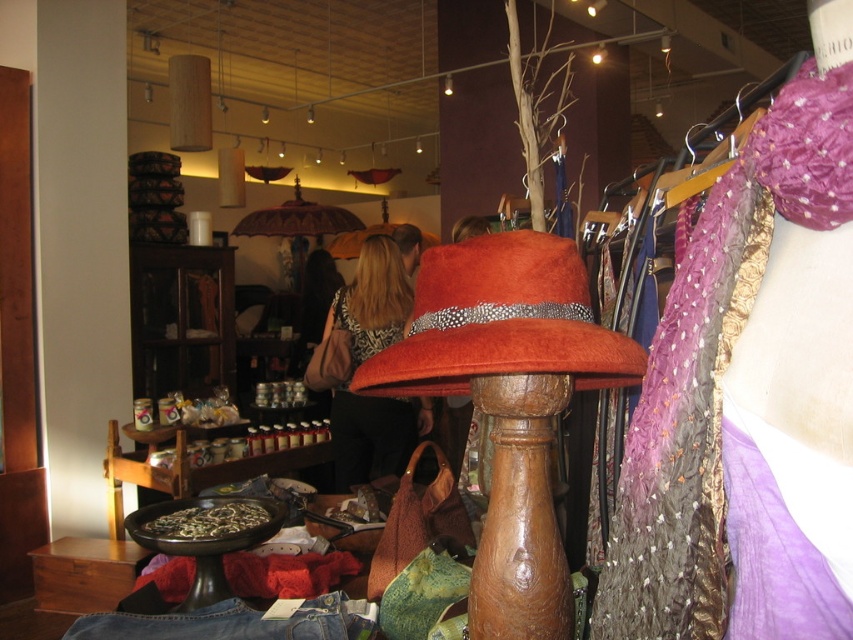
You are a customer in the store and want to know which item is smaller between the orange felt hat at center and the matte black dress at center. Which one is it?

The orange felt hat at center has a smaller size compared to the matte black dress at center, so the orange felt hat at center is the smaller one.

You are standing in the store and want to reach the item located at point (x=358, y=426). There is an obstacle at point (x=479, y=353). Based on the store layout, can you walk around the obstacle to reach your destination?

Point (x=479, y=353) is in front of point (x=358, y=426), so you cannot walk around the obstacle at point (x=479, y=353) to reach your destination because it is blocking the path.

You are a customer in the store and want to find the orange felt hat at center. Based on the store layout described, where should you look relative to the entrance?

The orange felt hat at center is located at point coordinates approximately 0.503 on the x and 0.587 on the y axis. Since the store entrance is typically at the front, the hat is centrally positioned, so you should look towards the middle of the store.